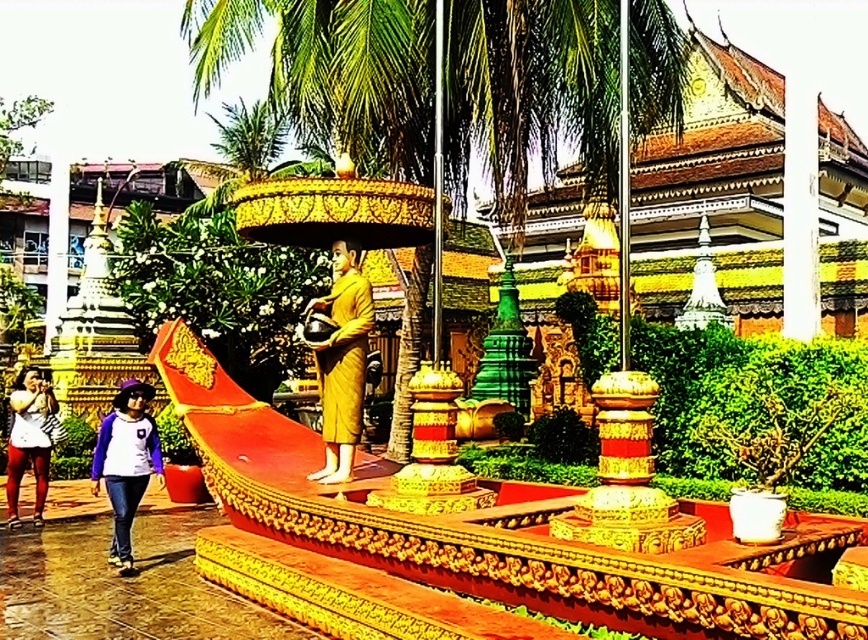
Based on the photo, how distant is yellow matte statue at center from matte white shirt at lower left?

yellow matte statue at center is 6.78 meters away from matte white shirt at lower left.

Can you confirm if yellow matte statue at center is shorter than matte white shirt at lower left?

In fact, yellow matte statue at center may be taller than matte white shirt at lower left.

Locate an element on the screen. The height and width of the screenshot is (640, 868). yellow matte statue at center is located at coordinates (342, 360).

Does golden polished boat at center have a smaller size compared to matte white shirt at lower left?

Yes.

Describe the element at coordinates (465, 541) in the screenshot. The height and width of the screenshot is (640, 868). I see `golden polished boat at center` at that location.

Looking at this image, measure the distance between point (358, 573) and camera.

They are 8.00 meters apart.

You are a GUI agent. You are given a task and a screenshot of the screen. Output one action in this format:
    pyautogui.click(x=<x>, y=<y>)
    Task: Click on the golden polished boat at center
    The width and height of the screenshot is (868, 640).
    Given the screenshot: What is the action you would take?
    pyautogui.click(x=465, y=541)

Between golden polished boat at center and white cotton shirt at lower left, which one appears on the left side from the viewer's perspective?

Positioned to the left is white cotton shirt at lower left.

Find the location of `golden polished boat at center`. golden polished boat at center is located at coordinates (465, 541).

Where is `golden polished boat at center`? golden polished boat at center is located at coordinates (465, 541).